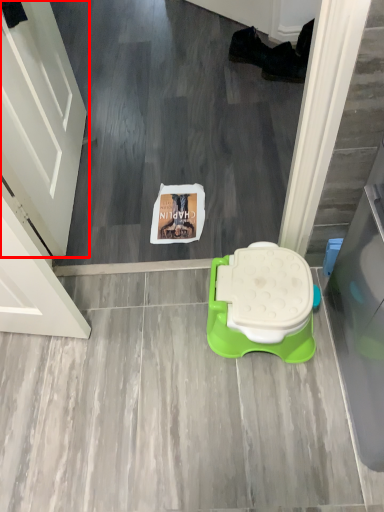
Question: From the image's perspective, considering the relative positions of door (annotated by the red box) and toilet in the image provided, where is door (annotated by the red box) located with respect to the staircase?

Choices:
 (A) above
 (B) below

Answer: (A)